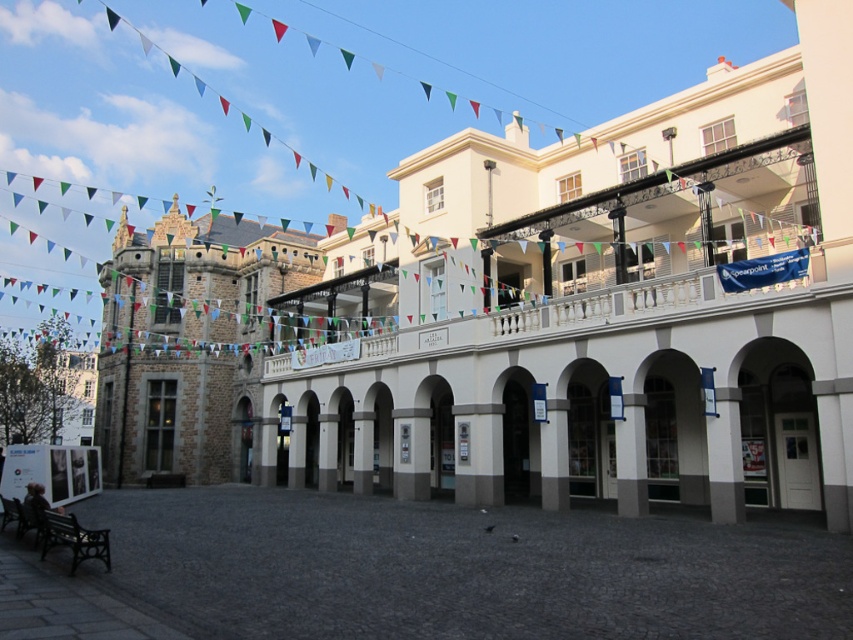
Does dark gray cobblestone courtyard at center appear under stone building at center?

Correct, dark gray cobblestone courtyard at center is located below stone building at center.

Is dark gray cobblestone courtyard at center bigger than stone building at center?

No, dark gray cobblestone courtyard at center is not bigger than stone building at center.

Image resolution: width=853 pixels, height=640 pixels. I want to click on dark gray cobblestone courtyard at center, so click(x=459, y=570).

Where is `dark gray cobblestone courtyard at center`? Image resolution: width=853 pixels, height=640 pixels. dark gray cobblestone courtyard at center is located at coordinates (459, 570).

Is point (114, 449) less distant than point (67, 540)?

That is False.

Between stone building at center and brown wooden bench at lower left, which one is positioned higher?

stone building at center is higher up.

Between point (190, 412) and point (96, 538), which one is positioned in front?

Point (96, 538)

Locate an element on the screen. The height and width of the screenshot is (640, 853). stone building at center is located at coordinates (189, 342).

Which is below, dark gray cobblestone courtyard at center or brown wooden bench at lower left?

dark gray cobblestone courtyard at center is lower down.

Who is more distant from viewer, (285, 540) or (99, 529)?

Positioned behind is point (99, 529).

Between point (792, 577) and point (51, 540), which one is positioned in front?

Point (792, 577) is more forward.

This screenshot has width=853, height=640. Find the location of `dark gray cobblestone courtyard at center`. dark gray cobblestone courtyard at center is located at coordinates (459, 570).